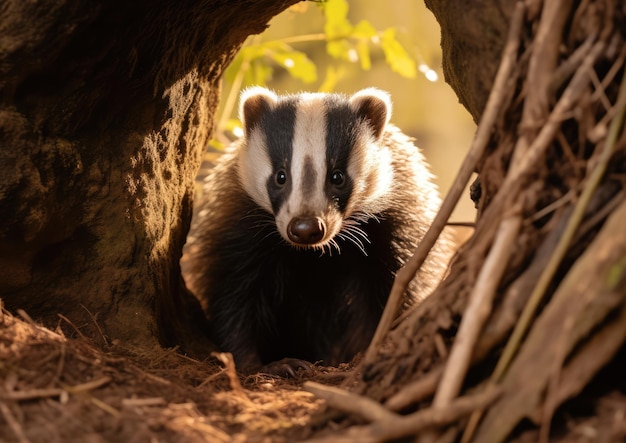
I want to click on plant, so click(x=297, y=55).